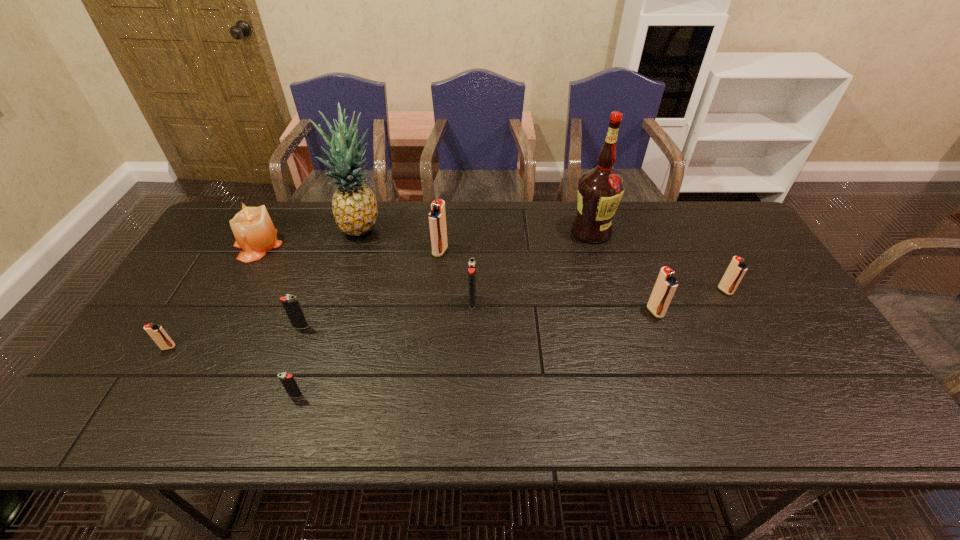
The image size is (960, 540). I want to click on igniter that is at the far edge, so click(x=437, y=217).

Find the location of a particular element. This screenshot has height=540, width=960. candle located at the far edge is located at coordinates (253, 229).

Where is `candle located at the left edge`? candle located at the left edge is located at coordinates (253, 229).

This screenshot has width=960, height=540. In order to click on igniter located in the left edge section of the desktop in this screenshot , I will do `click(156, 332)`.

This screenshot has height=540, width=960. I want to click on object that is at the right edge, so click(x=736, y=269).

You are a GUI agent. You are given a task and a screenshot of the screen. Output one action in this format:
    pyautogui.click(x=<x>, y=<y>)
    Task: Click on the object positioned at the far left corner
    This screenshot has width=960, height=540.
    Given the screenshot: What is the action you would take?
    pyautogui.click(x=253, y=229)

The width and height of the screenshot is (960, 540). In order to click on blank space at the far edge of the desktop in this screenshot , I will do `click(563, 239)`.

Where is `free spot at the near edge of the desktop`? Image resolution: width=960 pixels, height=540 pixels. free spot at the near edge of the desktop is located at coordinates (500, 433).

At what (x,y) coordinates should I click in order to perform the action: click on vacant area at the left edge. Please return your answer as a coordinate pair (x, y). Looking at the image, I should click on (225, 277).

This screenshot has height=540, width=960. In the image, there is a desktop. What are the coordinates of `blank space at the right edge` in the screenshot? It's located at (777, 276).